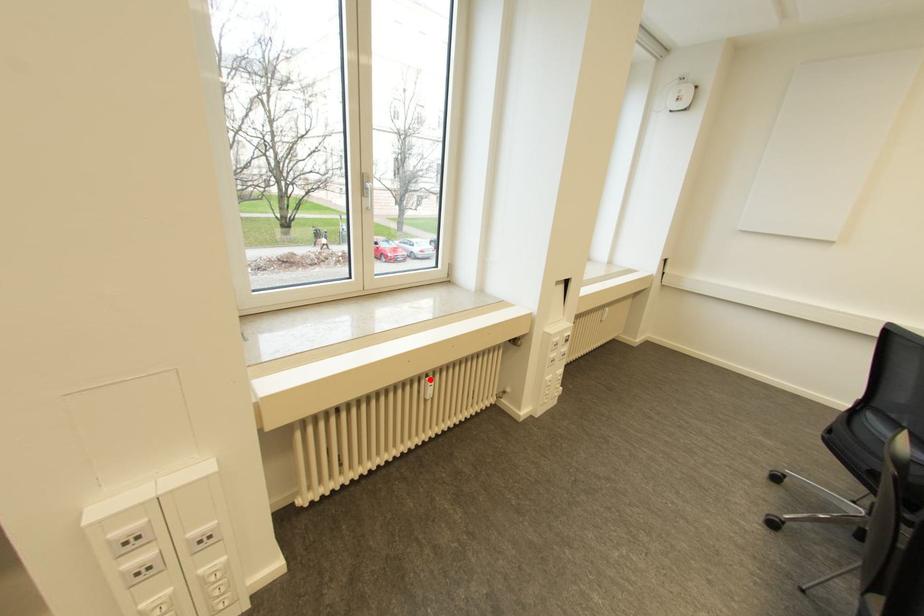
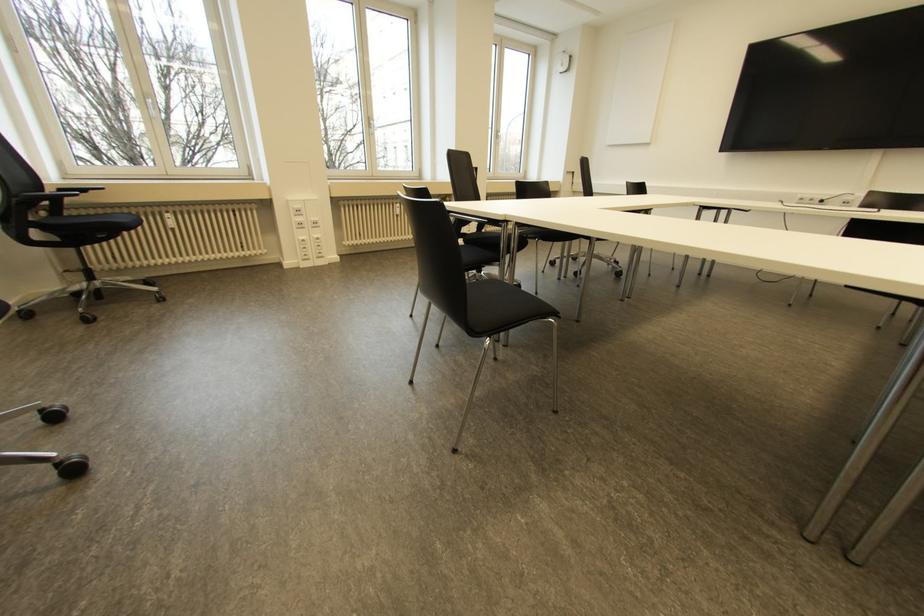
The point at the highlighted location is marked in the first image. Where is the corresponding point in the second image?

(397, 204)